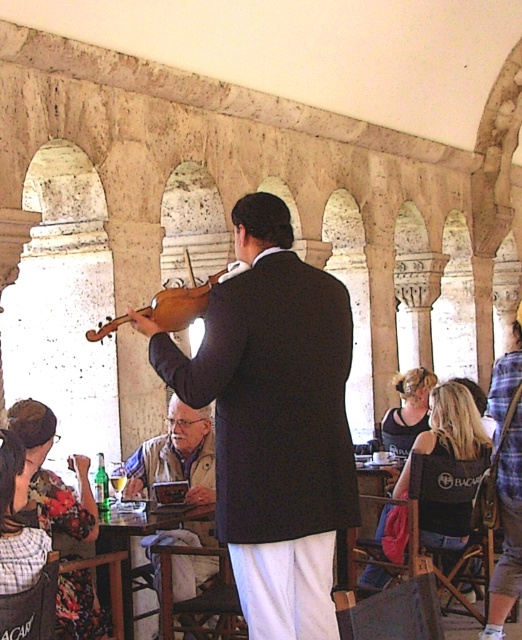
From the picture: Does dark brown wood violin at center lie behind wooden violin at center?

No, it is not.

Is dark brown wood violin at center to the right of wooden violin at center from the viewer's perspective?

Correct, you'll find dark brown wood violin at center to the right of wooden violin at center.

Locate an element on the screen. dark brown wood violin at center is located at coordinates (274, 420).

Can you confirm if dark brown wood violin at center is wider than white textured vest at center?

Correct, the width of dark brown wood violin at center exceeds that of white textured vest at center.

The width and height of the screenshot is (522, 640). I want to click on dark brown wood violin at center, so click(x=274, y=420).

Is white textured vest at center positioned before wooden violin at center?

No, it is behind wooden violin at center.

Is point (188, 464) farther from camera compared to point (183, 300)?

Yes, it is.

Is point (145, 442) behind point (203, 314)?

Yes, it is behind point (203, 314).

The height and width of the screenshot is (640, 522). What are the coordinates of `white textured vest at center` in the screenshot? It's located at (176, 456).